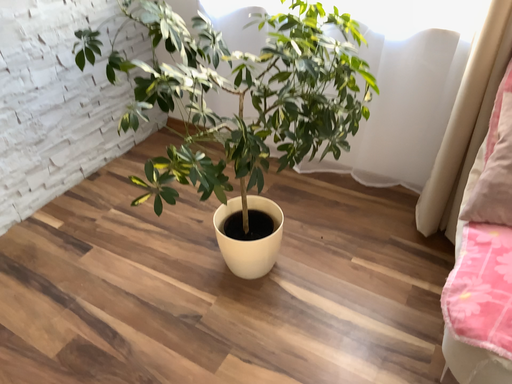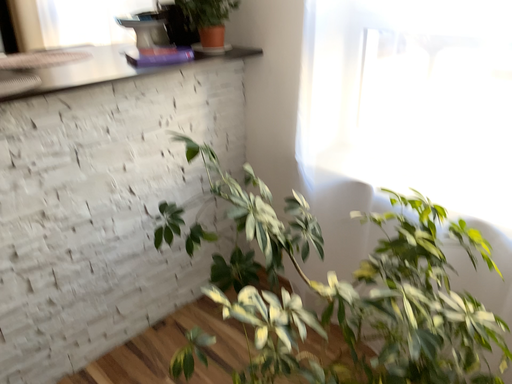
Question: How did the camera likely rotate when shooting the video?

Choices:
 (A) rotated upward
 (B) rotated downward

Answer: (A)